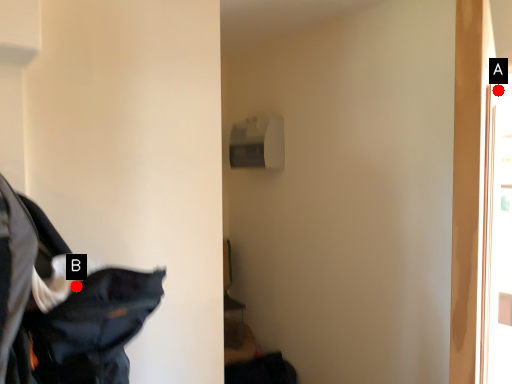
Question: Two points are circled on the image, labeled by A and B beside each circle. Among these points, which one is nearest to the camera?

Choices:
 (A) A is closer
 (B) B is closer

Answer: (B)